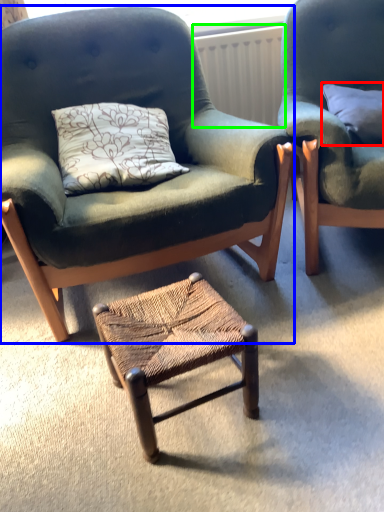
Question: Which object is positioned closest to pillow (highlighted by a red box)? Select from chair (highlighted by a blue box) and radiator (highlighted by a green box).

Choices:
 (A) chair
 (B) radiator

Answer: (B)